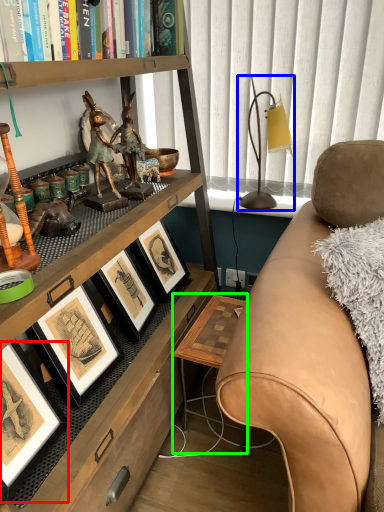
Question: Which object is the closest to the picture frame (highlighted by a red box)? Choose among these: table lamp (highlighted by a blue box) or table (highlighted by a green box).

Choices:
 (A) table lamp
 (B) table

Answer: (B)